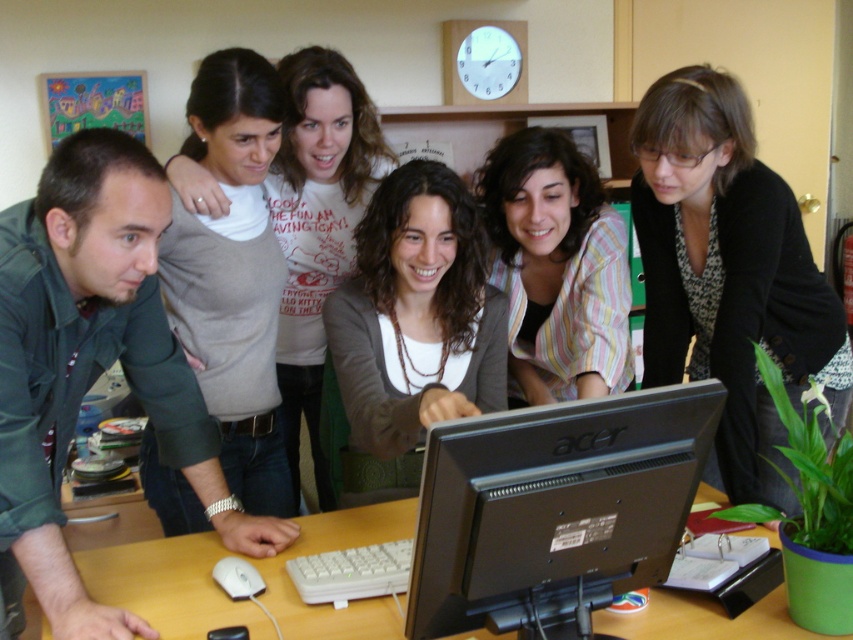
Question: Which point is farther to the camera?

Choices:
 (A) (758, 244)
 (B) (360, 253)
 (C) (242, 352)
 (D) (216, 582)

Answer: (C)

Question: Is brown matte sweater at center smaller than wooden table at center?

Choices:
 (A) no
 (B) yes

Answer: (A)

Question: Which is nearer to the black textured blazer at center?

Choices:
 (A) striped fabric shirt at center
 (B) white t-shirt at center
 (C) brown matte sweater at center

Answer: (A)

Question: Where is black textured blazer at center located in relation to brown matte sweater at center in the image?

Choices:
 (A) right
 (B) left

Answer: (A)

Question: Can you confirm if black matte monitor at center is positioned to the right of black textured blazer at center?

Choices:
 (A) yes
 (B) no

Answer: (B)

Question: Based on their relative distances, which object is farther from the white matte mouse at lower left?

Choices:
 (A) brown matte sweater at center
 (B) wooden table at center
 (C) striped fabric shirt at center
 (D) black textured blazer at center

Answer: (D)